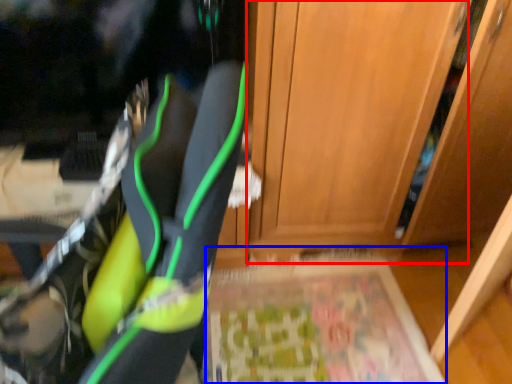
Question: Which object appears farthest to the camera in this image, door (highlighted by a red box) or yoga mat (highlighted by a blue box)?

Choices:
 (A) door
 (B) yoga mat

Answer: (B)